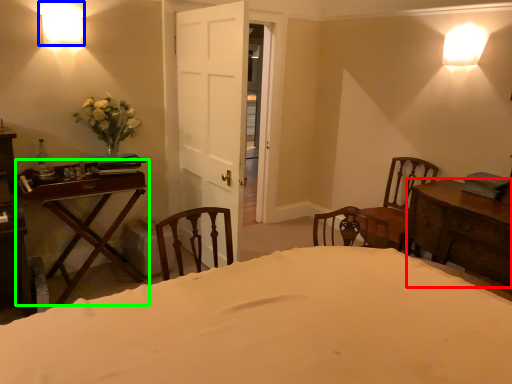
Question: Which is nearer to the table (highlighted by a red box)? lamp (highlighted by a blue box) or table (highlighted by a green box).

Choices:
 (A) lamp
 (B) table

Answer: (B)